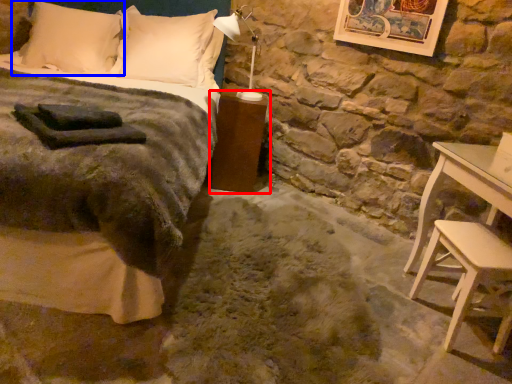
Question: Which object is closer to the camera taking this photo, nightstand (highlighted by a red box) or pillow (highlighted by a blue box)?

Choices:
 (A) nightstand
 (B) pillow

Answer: (A)